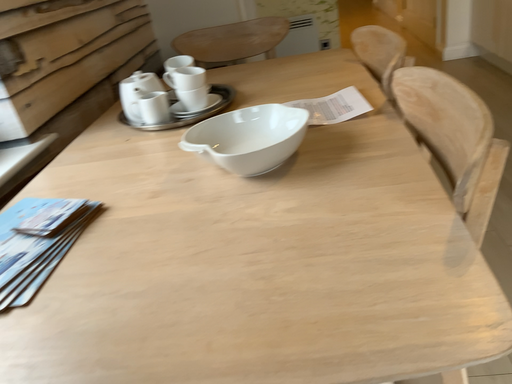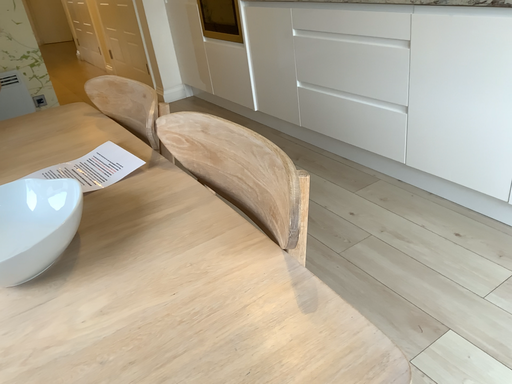
Question: How did the camera likely rotate when shooting the video?

Choices:
 (A) rotated downward
 (B) rotated upward

Answer: (B)